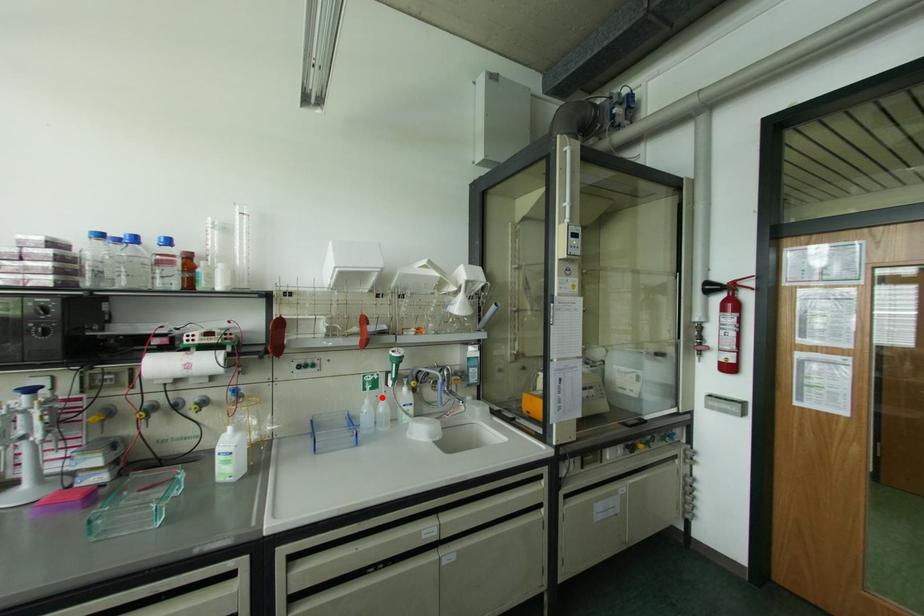
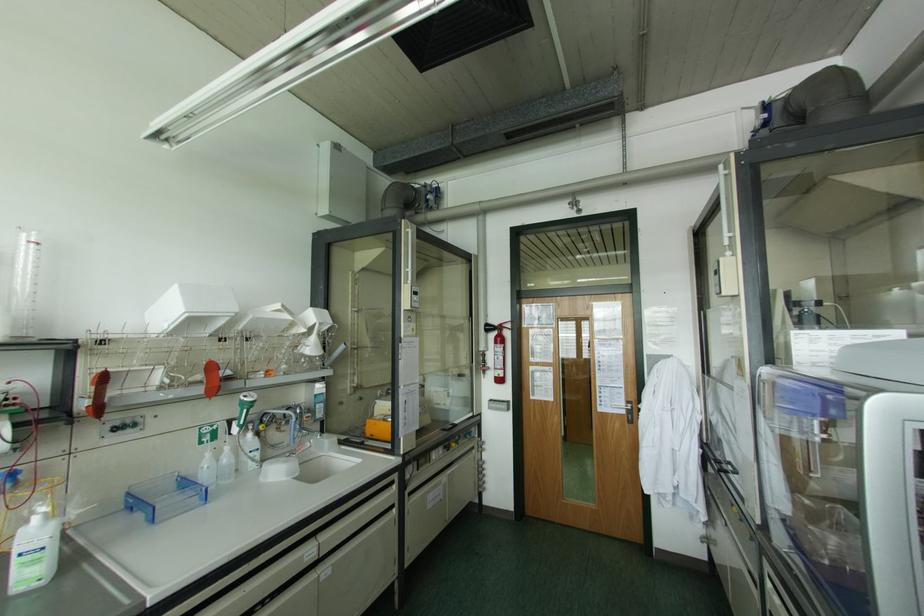
Question: I am providing you with two images of the same scene from different viewpoints. In image1, a red point is highlighted. Considering the same 3D point in image2, which of the following is correct?

Choices:
 (A) It is closer
 (B) It is farther

Answer: (A)